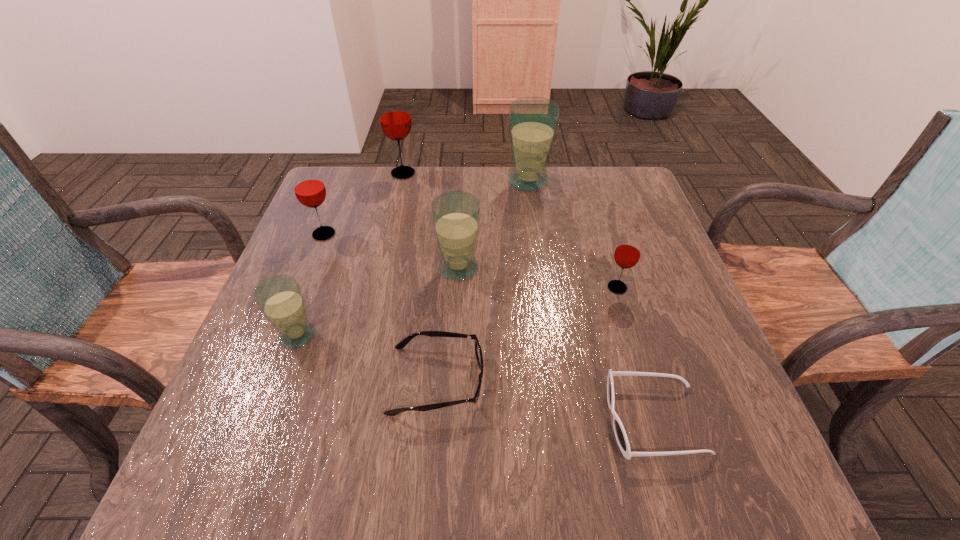
Image resolution: width=960 pixels, height=540 pixels. Identify the location of vacant position located 0.280m with the lenses of the sunglasses facing outward. (445, 420).

Find the location of a particular element. The height and width of the screenshot is (540, 960). vacant space located with the lenses of the sunglasses facing outward is located at coordinates (480, 420).

Locate an element on the screen. This screenshot has height=540, width=960. vacant space located 0.380m with the lenses of the sunglasses facing outward is located at coordinates point(388,420).

Image resolution: width=960 pixels, height=540 pixels. Identify the location of free space located on the front-facing side of the spectacles. (672, 380).

Where is `object that is at the near edge`? object that is at the near edge is located at coordinates (620, 434).

I want to click on glass present at the right edge, so click(x=627, y=253).

I want to click on sunglasses that is positioned at the right edge, so click(x=620, y=434).

This screenshot has width=960, height=540. I want to click on object that is at the near right corner, so click(620, 434).

Identify the location of vacant area at the far edge of the desktop. The image size is (960, 540). pyautogui.click(x=570, y=177).

Where is `vacant space at the near edge of the desktop`? vacant space at the near edge of the desktop is located at coordinates (648, 466).